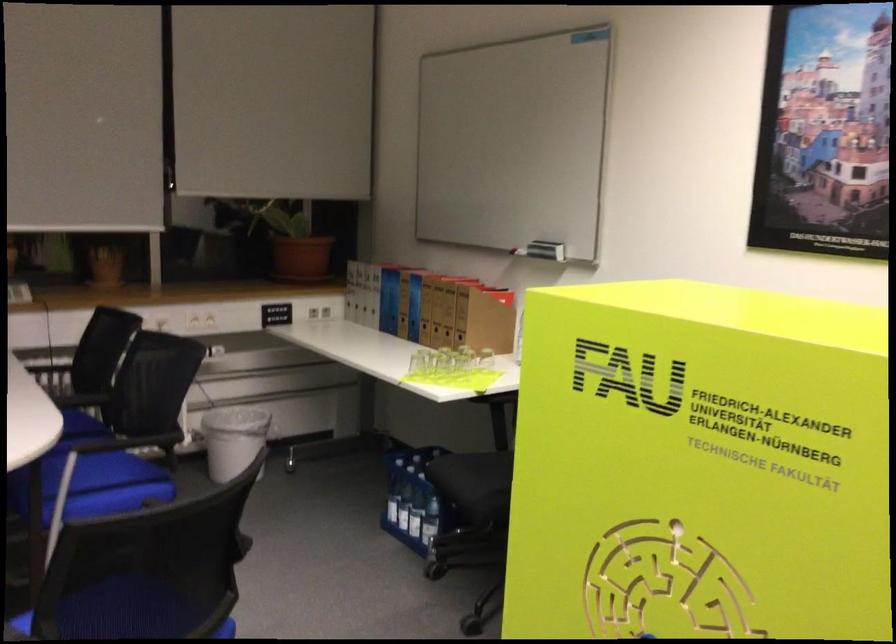
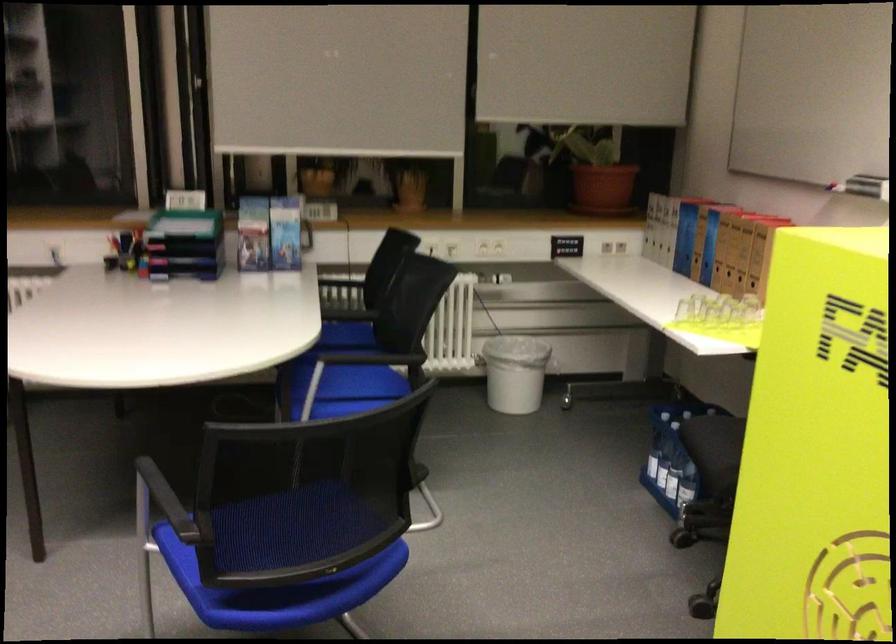
The point at (305, 259) is marked in the first image. Where is the corresponding point in the second image?

(602, 187)